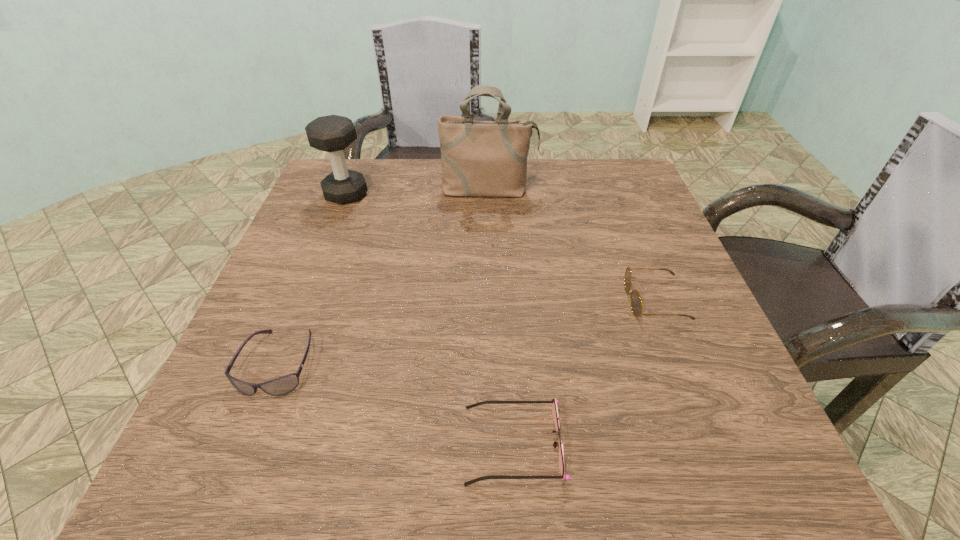
Where is `shoulder bag`? shoulder bag is located at coordinates (478, 158).

Find the location of a particular element. the second tallest object is located at coordinates (332, 133).

The image size is (960, 540). Find the location of `the rightmost sunglasses`. the rightmost sunglasses is located at coordinates (635, 301).

The height and width of the screenshot is (540, 960). I want to click on the third nearest object, so click(x=635, y=301).

Image resolution: width=960 pixels, height=540 pixels. In order to click on the second nearest object in this screenshot , I will do `click(283, 385)`.

You are a GUI agent. You are given a task and a screenshot of the screen. Output one action in this format:
    pyautogui.click(x=<x>, y=<y>)
    Task: Click on the leftmost sunglasses
    The image size is (960, 540).
    Given the screenshot: What is the action you would take?
    pyautogui.click(x=283, y=385)

You are a GUI agent. You are given a task and a screenshot of the screen. Output one action in this format:
    pyautogui.click(x=<x>, y=<y>)
    Task: Click on the nearest object
    This screenshot has width=960, height=540.
    Given the screenshot: What is the action you would take?
    pyautogui.click(x=554, y=407)

This screenshot has height=540, width=960. I want to click on the second sunglasses from left to right, so click(554, 407).

This screenshot has height=540, width=960. I want to click on vacant space located 0.090m on the front-facing side of the tallest object, so click(490, 224).

Find the location of a particular element. Image resolution: width=960 pixels, height=540 pixels. vacant space located 0.100m on the back of the second tallest object is located at coordinates (358, 163).